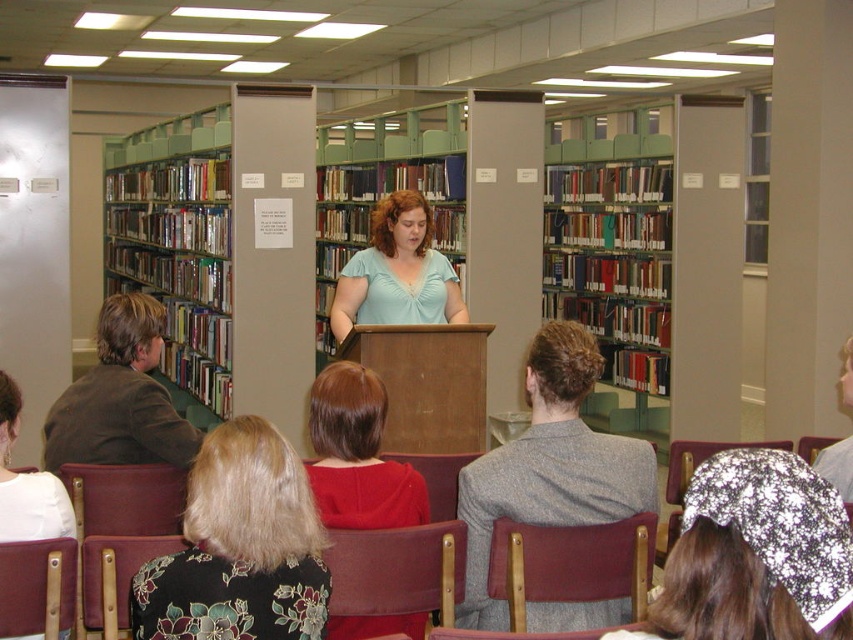
Question: Which of the following is the closest to the observer?

Choices:
 (A) (49, 550)
 (B) (677, 452)
 (C) (500, 300)
 (D) (334, 420)

Answer: (A)

Question: Among these objects, which one is farthest from the camera?

Choices:
 (A) floral fabric chair at lower left
 (B) smooth red blouse at center

Answer: (B)

Question: Can you confirm if sparkly silver headscarf at upper right is positioned below metallic silver chair at center?

Choices:
 (A) no
 (B) yes

Answer: (A)

Question: Which object is the farthest from the smooth red blouse at center?

Choices:
 (A) metallic silver chair at center
 (B) floral-patterned fabric at center

Answer: (A)

Question: Is gray wool suit at center in front of white fabric shirt at lower left?

Choices:
 (A) yes
 (B) no

Answer: (B)

Question: Is wooden chair at lower left bigger than metallic silver chair at center?

Choices:
 (A) yes
 (B) no

Answer: (B)